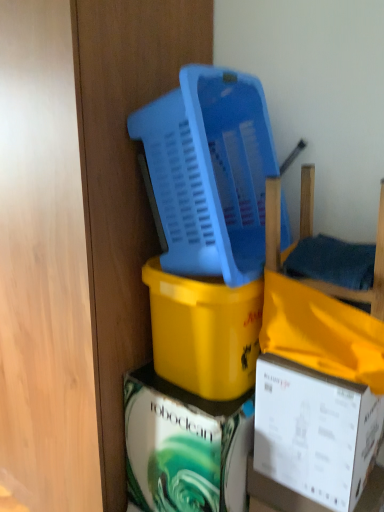
Question: Is matte white box at center, the 1th box when ordered from bottom to top, with blue plastic basket at upper center?

Choices:
 (A) yes
 (B) no

Answer: (B)

Question: From the image's perspective, is matte white box at center, the 1th box when ordered from bottom to top, located beneath blue plastic basket at upper center?

Choices:
 (A) no
 (B) yes

Answer: (B)

Question: From the image's perspective, is matte white box at center, positioned as the 3th box in top-to-bottom order, over blue plastic basket at upper center?

Choices:
 (A) no
 (B) yes

Answer: (A)

Question: From a real-world perspective, does matte white box at center, positioned as the 3th box in top-to-bottom order, sit lower than blue plastic basket at upper center?

Choices:
 (A) no
 (B) yes

Answer: (B)

Question: Is blue plastic basket at upper center a part of matte white box at center, positioned as the 3th box in top-to-bottom order?

Choices:
 (A) no
 (B) yes

Answer: (A)

Question: Does matte white box at center, positioned as the 3th box in top-to-bottom order, appear on the right side of blue plastic basket at upper center?

Choices:
 (A) no
 (B) yes

Answer: (A)

Question: Is white cardboard box at lower right, which is the second box from top to bottom, beside yellow matte plastic bucket at center, which ranks as the first box in top-to-bottom order?

Choices:
 (A) yes
 (B) no

Answer: (B)

Question: Does white cardboard box at lower right, which is the second box from top to bottom, have a lesser height compared to yellow matte plastic bucket at center, which is counted as the 3th box, starting from the bottom?

Choices:
 (A) yes
 (B) no

Answer: (A)

Question: From the image's perspective, is white cardboard box at lower right, which appears as the 2th box when ordered from the bottom, below yellow matte plastic bucket at center, which is counted as the 3th box, starting from the bottom?

Choices:
 (A) yes
 (B) no

Answer: (A)

Question: Does white cardboard box at lower right, which appears as the 2th box when ordered from the bottom, appear on the left side of yellow matte plastic bucket at center, which ranks as the first box in top-to-bottom order?

Choices:
 (A) yes
 (B) no

Answer: (B)

Question: Considering the relative sizes of white cardboard box at lower right, which is the second box from top to bottom, and yellow matte plastic bucket at center, which is counted as the 3th box, starting from the bottom, in the image provided, is white cardboard box at lower right, which is the second box from top to bottom, smaller than yellow matte plastic bucket at center, which is counted as the 3th box, starting from the bottom,?

Choices:
 (A) no
 (B) yes

Answer: (B)

Question: Is white cardboard box at lower right, which appears as the 2th box when ordered from the bottom, further to camera compared to yellow matte plastic bucket at center, which ranks as the first box in top-to-bottom order?

Choices:
 (A) no
 (B) yes

Answer: (A)

Question: Can you confirm if yellow matte plastic bucket at center, which is counted as the 3th box, starting from the bottom, is bigger than wooden chair at right?

Choices:
 (A) yes
 (B) no

Answer: (A)